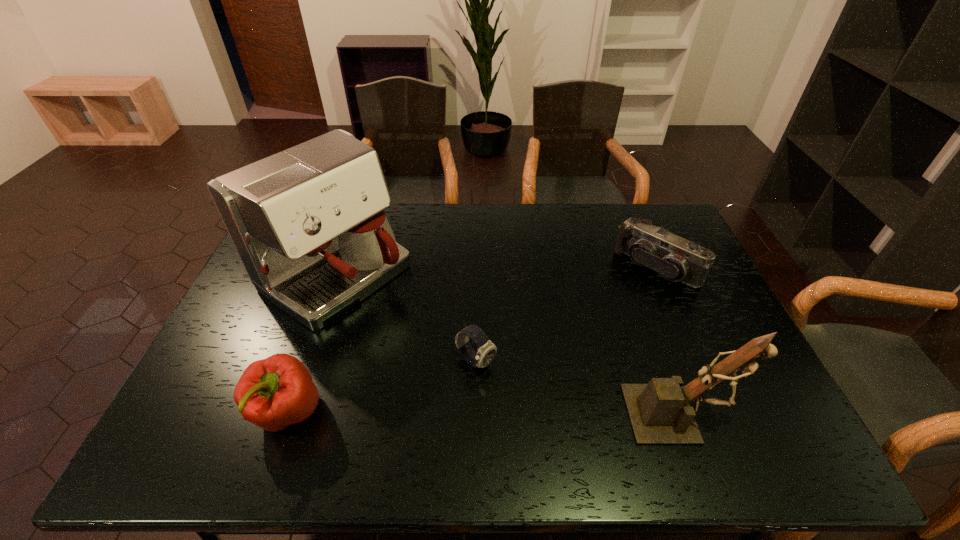
Identify which object is the closest to the bell pepper. Please provide its 2D coordinates. Your answer should be formatted as a tuple, i.e. [(x, y)], where the tuple contains the x and y coordinates of a point satisfying the conditions above.

[(308, 224)]

This screenshot has width=960, height=540. I want to click on vacant space that satisfies the following two spatial constraints: 1. on the back side of the third farthest object; 2. on the left side of the bell pepper, so click(305, 362).

Identify the location of vacant area in the image that satisfies the following two spatial constraints: 1. on the front side of the figurine; 2. on the front-facing side of the coffee maker. (287, 414).

Locate an element on the screen. The height and width of the screenshot is (540, 960). free location that satisfies the following two spatial constraints: 1. on the front side of the shortest object; 2. on the front-facing side of the fourth shortest object is located at coordinates (475, 414).

Locate an element on the screen. The width and height of the screenshot is (960, 540). free spot that satisfies the following two spatial constraints: 1. on the back side of the third nearest object; 2. on the right side of the camcorder is located at coordinates (477, 267).